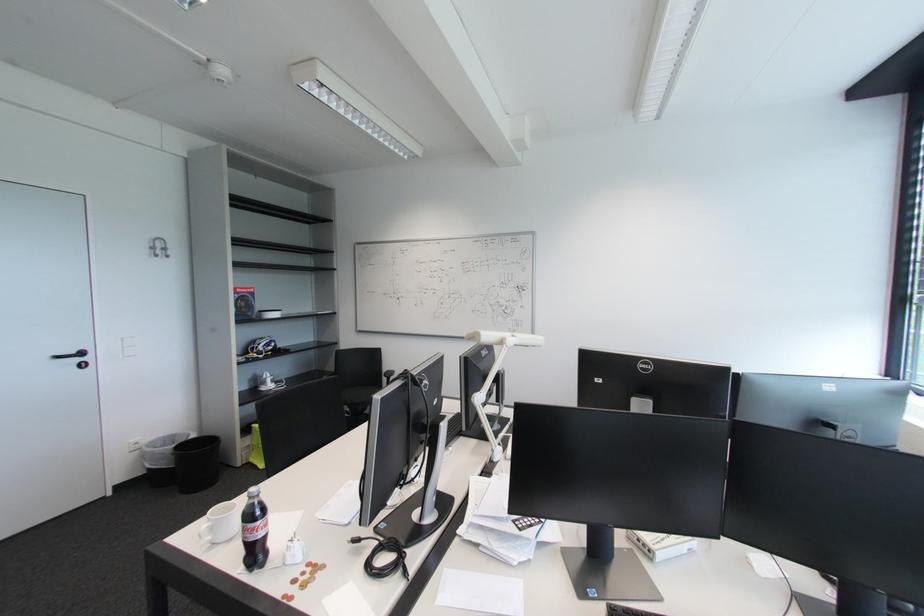
Identify the location of blue bicycle helmet. 261,346.